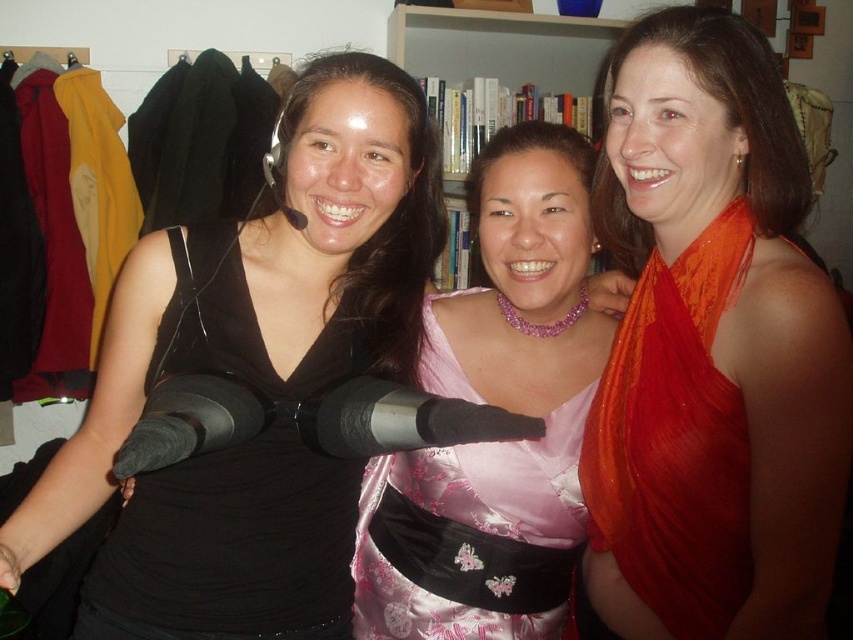
You are a photographer adjusting your camera settings to capture the vibrant colors in the scene. You notice the orange silk scarf at upper right and the pink satin dress at center. Which object is positioned higher in the image?

The orange silk scarf at upper right is positioned higher than the pink satin dress at center.

You are a photographer trying to capture a group photo of the black satin dress at left and hardcover books at center. Which object should you focus on first if you want to ensure both are in frame without moving the camera?

The black satin dress at left is narrower than the hardcover books at center, so you should focus on the hardcover books at center first to ensure they fit within the frame.

You are a photographer adjusting your camera to focus on two specific points in the image. The first point is at coordinates point (697, 474) and the second is at point (143, 509). Which point should you focus on first if you want to capture the closest object to the camera?

Point (697, 474) is closer to the camera than point (143, 509), so you should focus on point (697, 474) first to capture the closest object.